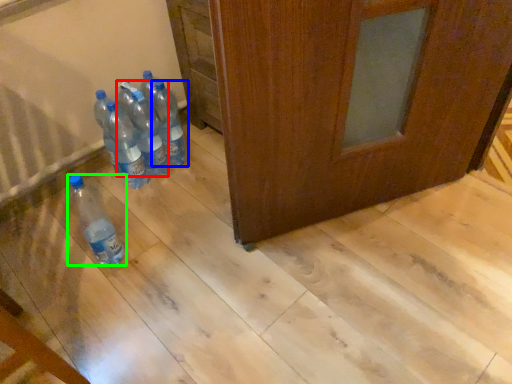
Question: Which is farther away from bottle (highlighted by a red box)? bottle (highlighted by a blue box) or bottle (highlighted by a green box)?

Choices:
 (A) bottle
 (B) bottle

Answer: (B)